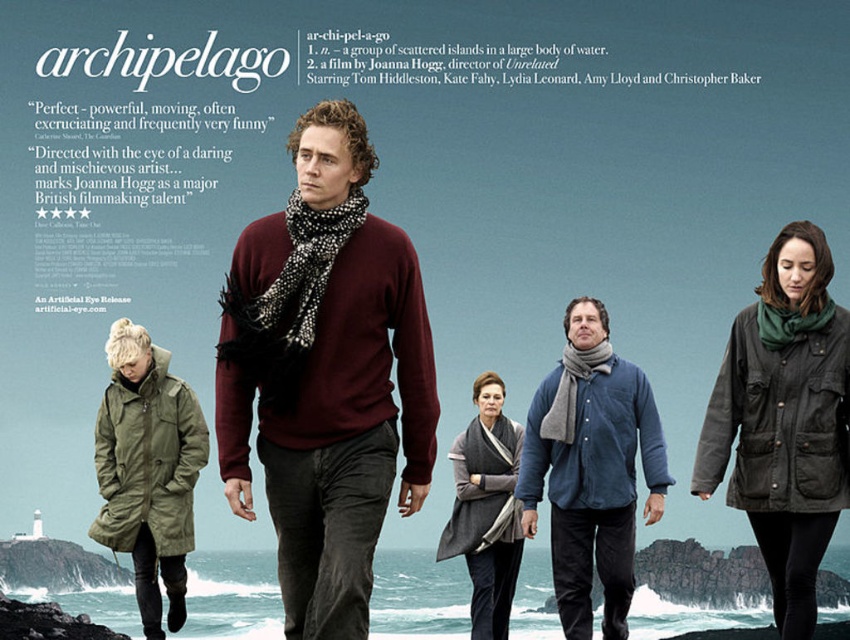
You are standing at the edge of the shoreline in the movie poster for Archipelago. You need to hand a note to the person wearing the maroon sweater at center, who is 19.15 meters away from the person wearing the blue corduroy jacket at center. If you can throw the note 20 meters, will you be able to reach them?

The maroon sweater at center is 19.15 meters away from the blue corduroy jacket at center. Since you can throw the note 20 meters, you will be able to reach them.

You are a movie poster designer who needs to place a text box on the poster. The text box must be placed on the maroon sweater at center. Is the point at coordinates (326,376) suitable for placing the text box?

Yes, the point at coordinates (326,376) is suitable for placing the text box because it is located on the maroon sweater at center as specified.

Based on the movie poster for Archipelago, if you are facing the five individuals walking towards you along the rocky shoreline, which of the two points, point (554, 564) or point (480, 548), is closer to you?

Point (554, 564) is in front of point (480, 548), so it is closer to you.